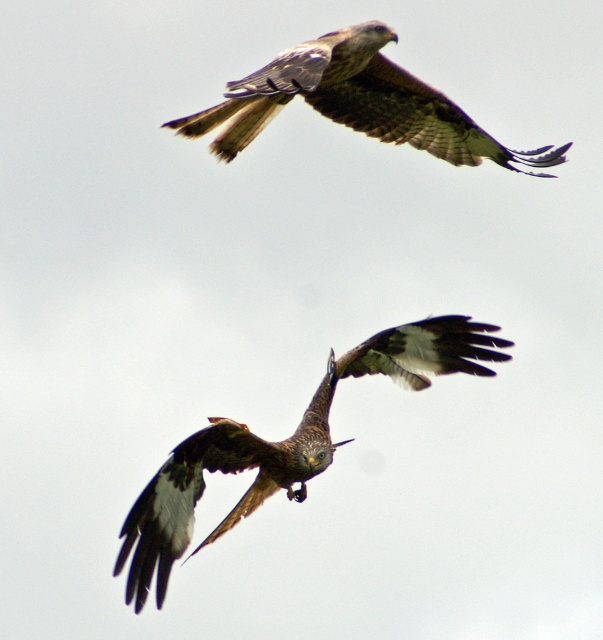
Question: Does brown speckled eagle at center lie behind brown feathered eagle at upper center?

Choices:
 (A) no
 (B) yes

Answer: (A)

Question: Observing the image, what is the correct spatial positioning of brown speckled eagle at center in reference to brown feathered eagle at upper center?

Choices:
 (A) left
 (B) right

Answer: (A)

Question: Which point is closer to the camera?

Choices:
 (A) brown speckled eagle at center
 (B) brown feathered eagle at upper center

Answer: (A)

Question: Which of the following is the closest to the observer?

Choices:
 (A) (300, 496)
 (B) (267, 113)

Answer: (A)

Question: Is brown speckled eagle at center to the left of brown feathered eagle at upper center from the viewer's perspective?

Choices:
 (A) yes
 (B) no

Answer: (A)